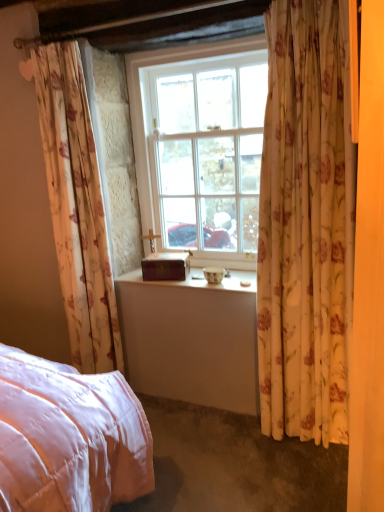
The image size is (384, 512). I want to click on vacant area situated below wooden box at center (from a real-world perspective), so click(x=164, y=280).